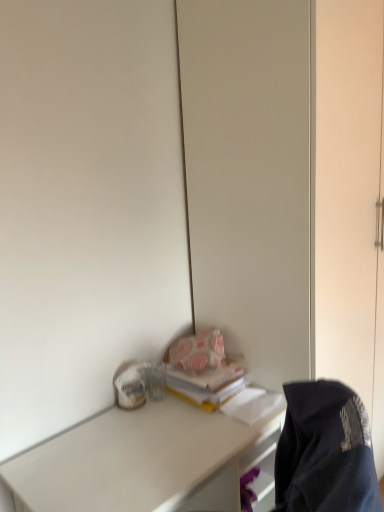
Question: Do you think dark blue fabric jacket at lower right is within yellow matte book at center, or outside of it?

Choices:
 (A) outside
 (B) inside

Answer: (A)

Question: Is dark blue fabric jacket at lower right taller or shorter than yellow matte book at center?

Choices:
 (A) tall
 (B) short

Answer: (A)

Question: Which object is positioned farthest from the dark blue fabric jacket at lower right?

Choices:
 (A) white matte desk at lower left
 (B) yellow matte book at center

Answer: (B)

Question: Which object is the farthest from the dark blue fabric jacket at lower right?

Choices:
 (A) yellow matte book at center
 (B) white matte desk at lower left

Answer: (A)